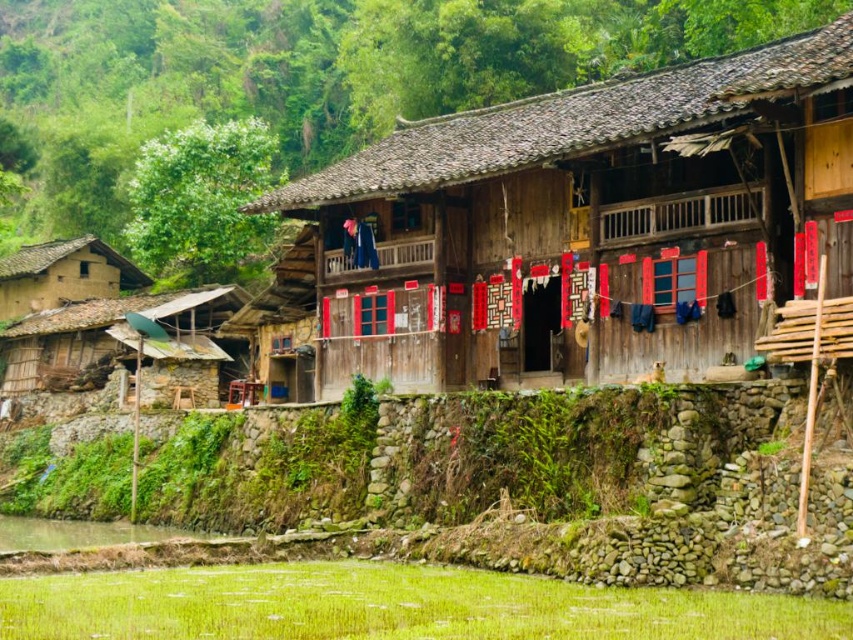
Question: Which of the following is the farthest from the observer?

Choices:
 (A) rustic wooden hut at left
 (B) brown mud hut at left
 (C) wooden house at center

Answer: (B)

Question: Is wooden house at center above brown mud hut at left?

Choices:
 (A) yes
 (B) no

Answer: (A)

Question: Does wooden house at center appear over brown mud hut at left?

Choices:
 (A) yes
 (B) no

Answer: (A)

Question: Which is farther from the brown mud hut at left?

Choices:
 (A) wooden house at center
 (B) rustic wooden hut at left

Answer: (A)

Question: Is the position of wooden house at center less distant than that of rustic wooden hut at left?

Choices:
 (A) no
 (B) yes

Answer: (B)

Question: Which of the following is the farthest from the observer?

Choices:
 (A) (509, 163)
 (B) (38, 275)

Answer: (B)